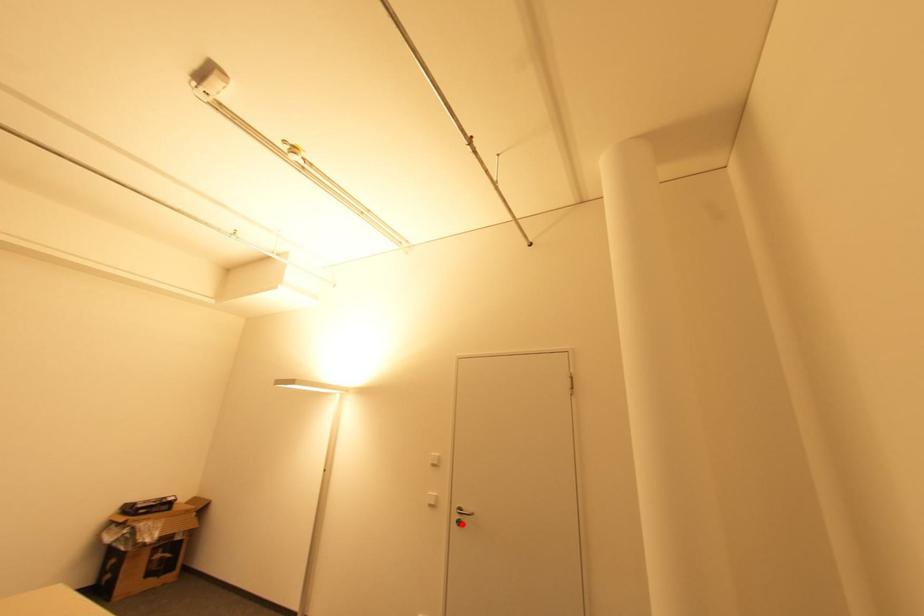
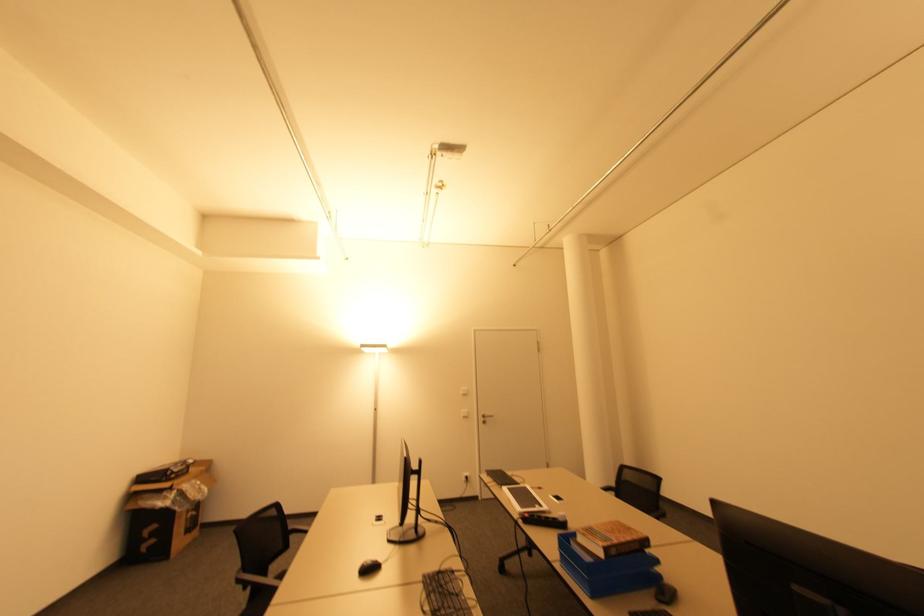
The point at the highlighted location is marked in the first image. Where is the corresponding point in the second image?

(485, 422)